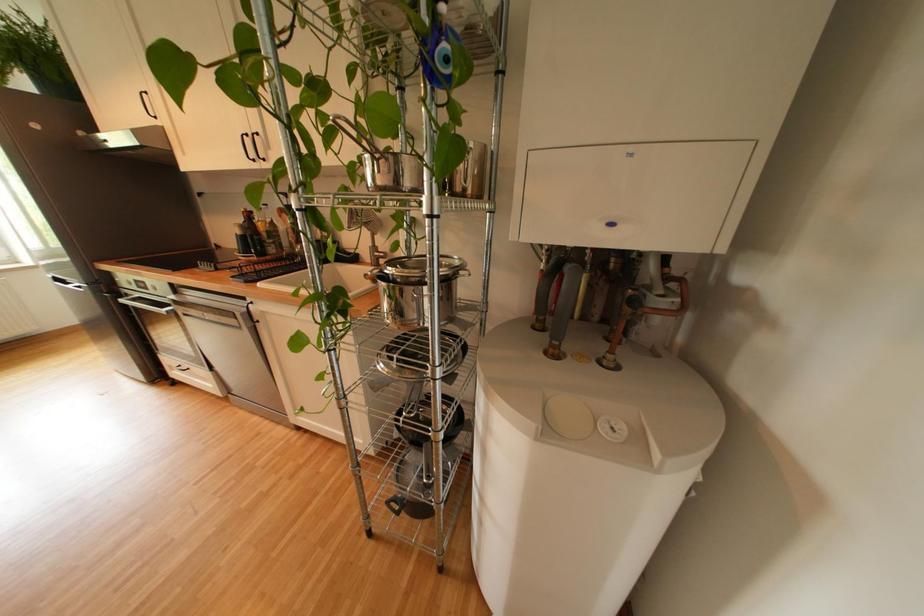
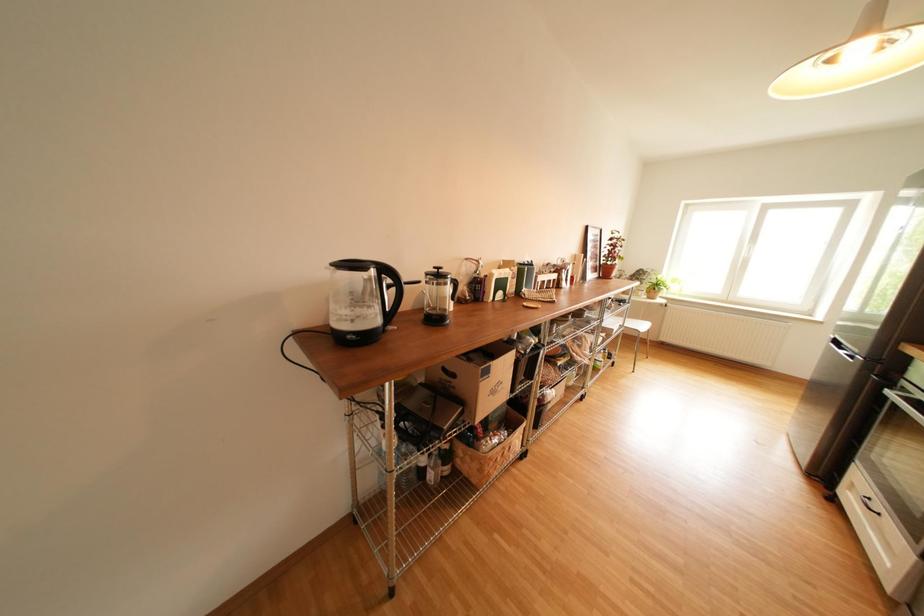
Based on the continuous images, in which direction is the camera rotating?

The camera's rotation is toward left-down.